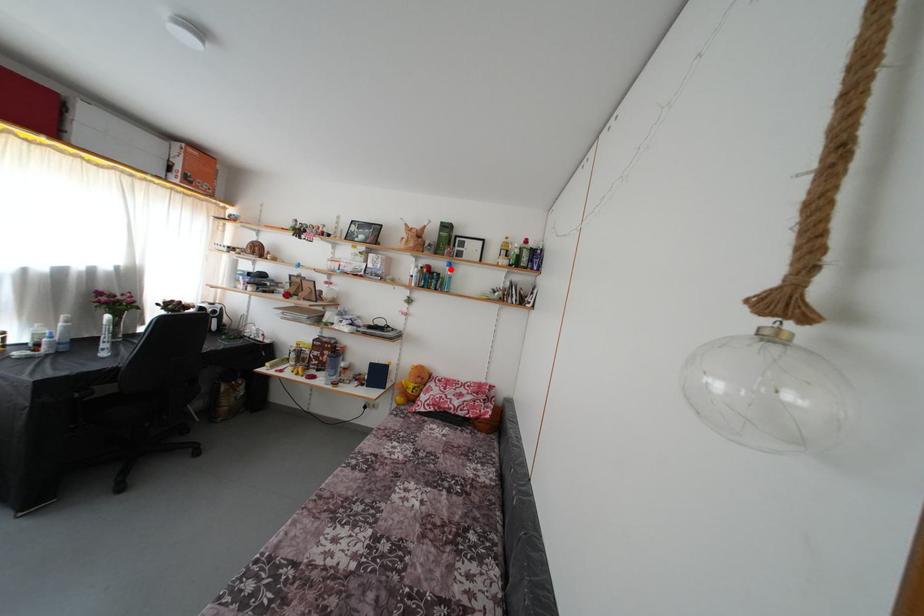
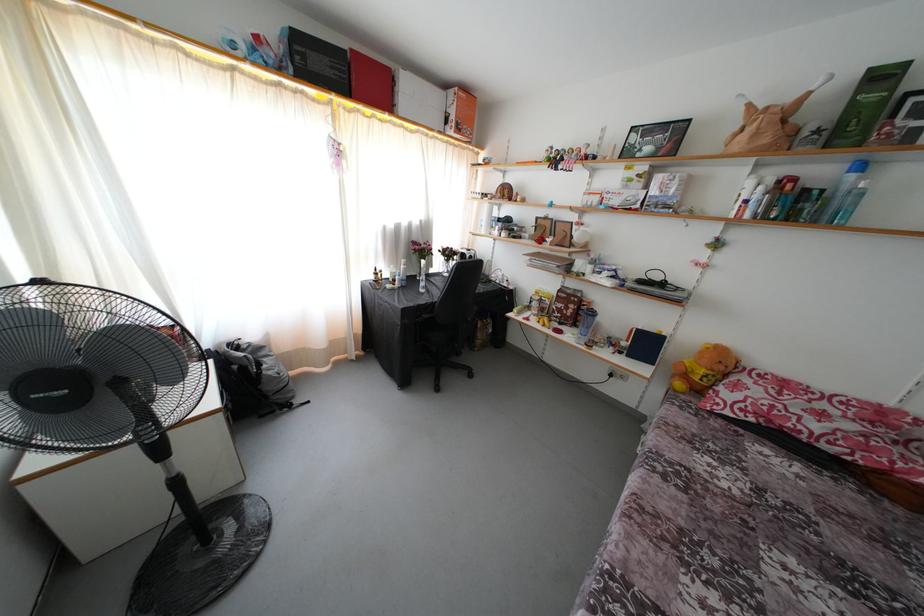
Question: I am providing you with two images of the same scene from different viewpoints. In image1, a red point is highlighted. Considering the same 3D point in image2, which of the following is correct?

Choices:
 (A) It is closer
 (B) It is farther

Answer: (B)